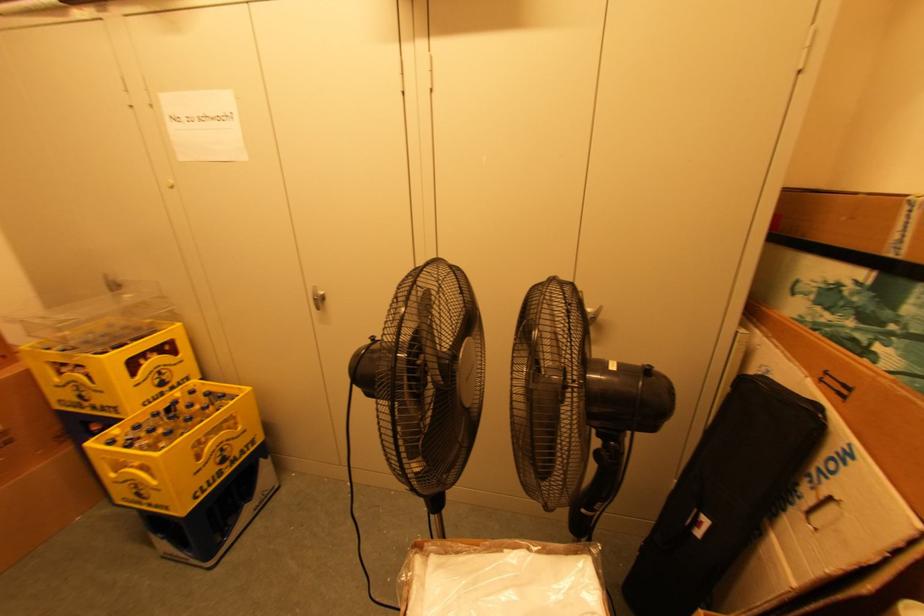
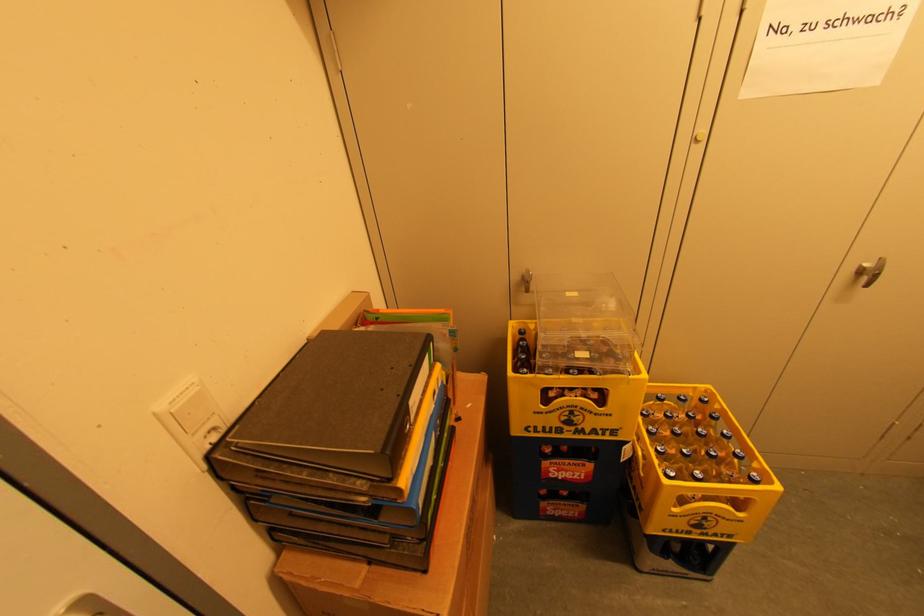
Question: What movement of the cameraman would produce the second image?

Choices:
 (A) Left
 (B) Right
 (C) Forward
 (D) Backward

Answer: (A)